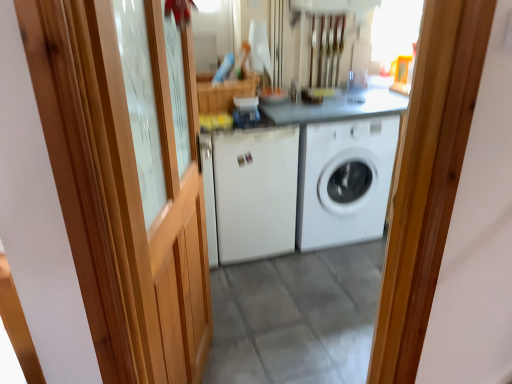
Question: Is white matte washing machine at center, the 2th washing machine from the right, thinner than wooden barn door at left?

Choices:
 (A) no
 (B) yes

Answer: (A)

Question: Is white matte washing machine at center, which is the 1th washing machine in left-to-right order, to the left of wooden barn door at left from the viewer's perspective?

Choices:
 (A) no
 (B) yes

Answer: (A)

Question: Can you confirm if white matte washing machine at center, which is the 1th washing machine in left-to-right order, is positioned to the right of wooden barn door at left?

Choices:
 (A) yes
 (B) no

Answer: (A)

Question: From the image's perspective, does white matte washing machine at center, the 2th washing machine from the right, appear lower than wooden barn door at left?

Choices:
 (A) no
 (B) yes

Answer: (A)

Question: Considering the relative sizes of white matte washing machine at center, which is the 1th washing machine in left-to-right order, and wooden barn door at left in the image provided, is white matte washing machine at center, which is the 1th washing machine in left-to-right order, bigger than wooden barn door at left?

Choices:
 (A) yes
 (B) no

Answer: (A)

Question: From the image's perspective, is white matte washing machine at center, the 2th washing machine from the right, above wooden barn door at left?

Choices:
 (A) no
 (B) yes

Answer: (B)

Question: Does wooden barn door at left touch white matte washing machine at center, arranged as the second washing machine when viewed from the left?

Choices:
 (A) yes
 (B) no

Answer: (B)

Question: From a real-world perspective, is wooden barn door at left over white matte washing machine at center, arranged as the second washing machine when viewed from the left?

Choices:
 (A) yes
 (B) no

Answer: (A)

Question: Considering the relative sizes of wooden barn door at left and white matte washing machine at center, arranged as the second washing machine when viewed from the left, in the image provided, is wooden barn door at left wider than white matte washing machine at center, arranged as the second washing machine when viewed from the left,?

Choices:
 (A) no
 (B) yes

Answer: (A)

Question: Can you confirm if wooden barn door at left is thinner than white matte washing machine at center, the first washing machine positioned from the right?

Choices:
 (A) no
 (B) yes

Answer: (B)

Question: From the image's perspective, is wooden barn door at left beneath white matte washing machine at center, arranged as the second washing machine when viewed from the left?

Choices:
 (A) no
 (B) yes

Answer: (B)

Question: Is wooden barn door at left far away from white matte washing machine at center, the first washing machine positioned from the right?

Choices:
 (A) no
 (B) yes

Answer: (B)

Question: From the image's perspective, would you say wooden barn door at left is shown under white matte washing machine at center, which is the 1th washing machine in left-to-right order?

Choices:
 (A) no
 (B) yes

Answer: (B)